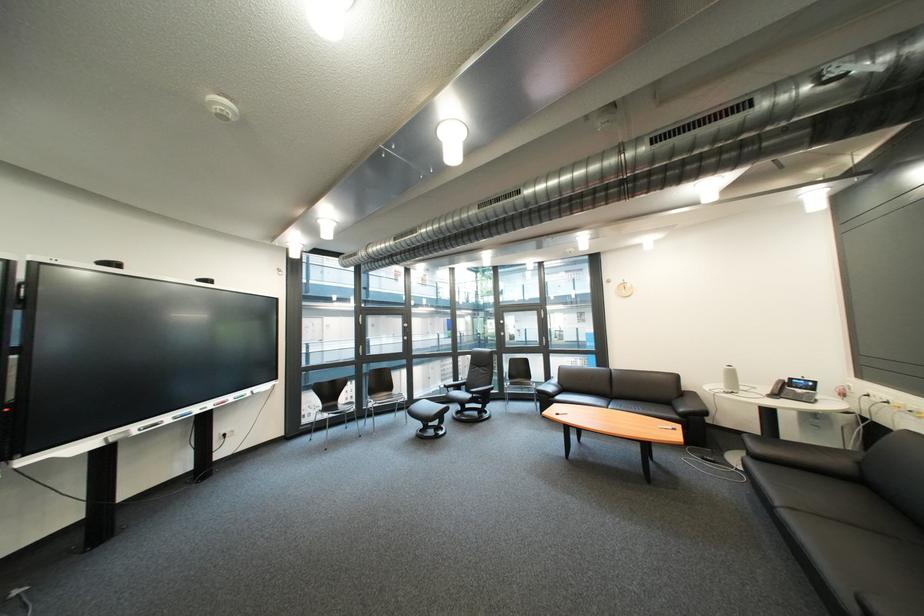
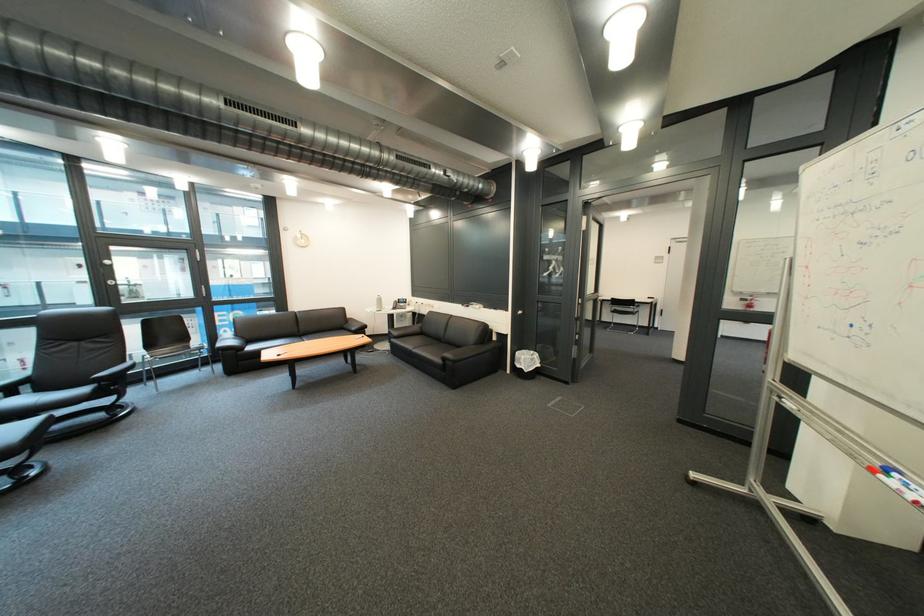
Find the pixel in the second image that matches point 468,390 in the first image.

(16, 395)